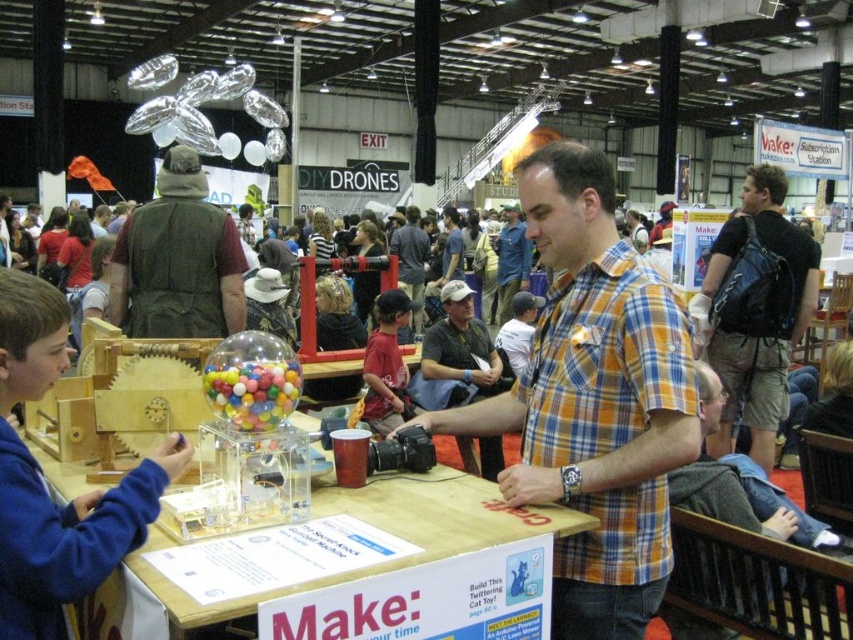
Question: Which point appears closest to the camera in this image?

Choices:
 (A) (416, 314)
 (B) (189, 289)
 (C) (523, 256)

Answer: (B)

Question: Does matte red shirt at center appear over plaid shirt at center?

Choices:
 (A) yes
 (B) no

Answer: (B)

Question: Is blue fleece jacket at center thinner than orange plaid shirt at center?

Choices:
 (A) no
 (B) yes

Answer: (B)

Question: Among these points, which one is nearest to the camera?

Choices:
 (A) (125, 275)
 (B) (804, 273)

Answer: (A)

Question: Is transparent acrylic table at center smaller than black leather backpack at right?

Choices:
 (A) no
 (B) yes

Answer: (B)

Question: Which point appears closest to the camera in this image?

Choices:
 (A) (511, 237)
 (B) (405, 496)
 (C) (471, 401)
 (D) (405, 250)

Answer: (B)